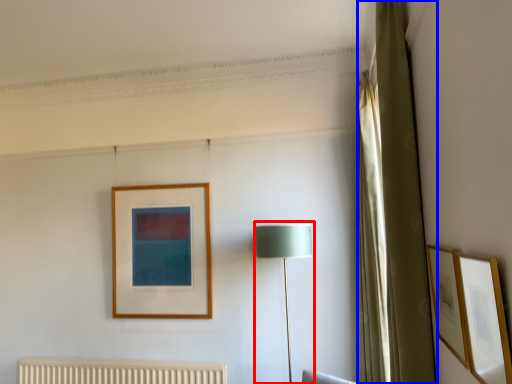
Question: Among these objects, which one is nearest to the camera, table lamp (highlighted by a red box) or curtain (highlighted by a blue box)?

Choices:
 (A) table lamp
 (B) curtain

Answer: (B)